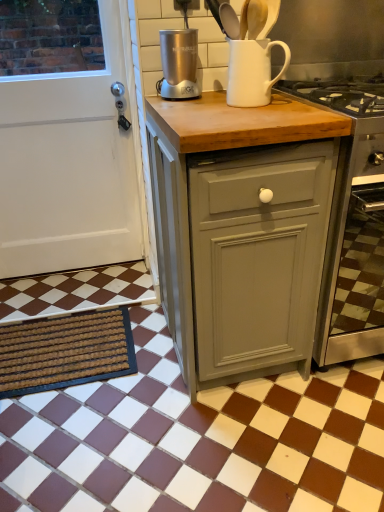
Describe the element at coordinates (179, 64) in the screenshot. I see `satin silver blender at center` at that location.

Measure the distance between point (165, 42) and camera.

Point (165, 42) is 1.32 meters away from camera.

The width and height of the screenshot is (384, 512). Find the location of `white matte door at left`. white matte door at left is located at coordinates (68, 167).

You are a GUI agent. You are given a task and a screenshot of the screen. Output one action in this format:
    pyautogui.click(x=<x>, y=<y>)
    Task: Click on the matte gray cabinet at center
    This screenshot has width=384, height=512.
    Given the screenshot: What is the action you would take?
    pyautogui.click(x=242, y=230)

Between brown/white checkered tile at lower center and brown textured mat at lower left, which one has smaller width?

brown textured mat at lower left.

From a real-world perspective, which is physically below, brown/white checkered tile at lower center or brown textured mat at lower left?

brown/white checkered tile at lower center, from a real-world perspective.

Would you say brown/white checkered tile at lower center is inside or outside brown textured mat at lower left?

brown/white checkered tile at lower center is spatially situated outside brown textured mat at lower left.

Considering the sizes of brown textured mat at lower left and brown/white checkered tile at lower center in the image, is brown textured mat at lower left taller or shorter than brown/white checkered tile at lower center?

→ brown textured mat at lower left is shorter than brown/white checkered tile at lower center.

From a real-world perspective, which is physically below, brown textured mat at lower left or brown/white checkered tile at lower center?

brown/white checkered tile at lower center.

Is the position of brown textured mat at lower left more distant than that of brown/white checkered tile at lower center?

That is True.

Is brown/white checkered tile at lower center at the back of brown textured mat at lower left?

No, brown/white checkered tile at lower center is not at the back of brown textured mat at lower left.

From a real-world perspective, which is physically above, brown textured mat at lower left or white matte door at left?

white matte door at left is physically above.

Which point is more distant from viewer, (x=20, y=324) or (x=75, y=130)?

Positioned behind is point (x=75, y=130).

From the picture: Between brown textured mat at lower left and white matte door at left, which one has larger size?

white matte door at left.

From a real-world perspective, is white matte door at left located higher than white matte jug at upper center?

Actually, white matte door at left is physically below white matte jug at upper center in the real world.

Does white matte door at left lie behind white matte jug at upper center?

Yes, white matte door at left is further from the camera.

How far apart are white matte door at left and white matte jug at upper center?

white matte door at left is 36.24 inches away from white matte jug at upper center.

From the image's perspective, is white matte door at left above or below white matte jug at upper center?

From the image's perspective, white matte door at left appears below white matte jug at upper center.

This screenshot has width=384, height=512. Find the location of `cabinetry positioned vertically above the brown textured mat at lower left (from a real-world perspective)`. cabinetry positioned vertically above the brown textured mat at lower left (from a real-world perspective) is located at coordinates (242, 230).

Considering their positions, is matte gray cabinet at center located in front of or behind brown textured mat at lower left?

Visually, matte gray cabinet at center is located in front of brown textured mat at lower left.

From a real-world perspective, is matte gray cabinet at center physically located above or below brown textured mat at lower left?

matte gray cabinet at center is above brown textured mat at lower left.

From the image's perspective, does matte gray cabinet at center appear higher than white matte door at left?

No, from the image's perspective, matte gray cabinet at center is not above white matte door at left.

Does point (286, 264) lie behind point (4, 247)?

That is False.

Does matte gray cabinet at center have a greater height compared to white matte door at left?

No, matte gray cabinet at center is not taller than white matte door at left.

Is matte gray cabinet at center not close to white matte door at left?

That's not correct — matte gray cabinet at center is a little close to white matte door at left.

Can you confirm if matte gray cabinet at center is bigger than brown/white checkered tile at lower center?

Correct, matte gray cabinet at center is larger in size than brown/white checkered tile at lower center.

Is matte gray cabinet at center not inside brown/white checkered tile at lower center?

matte gray cabinet at center is positioned outside brown/white checkered tile at lower center.

What's the angular difference between matte gray cabinet at center and brown/white checkered tile at lower center's facing directions?

89.5 degrees separate the facing orientations of matte gray cabinet at center and brown/white checkered tile at lower center.

From the image's perspective, is matte gray cabinet at center located beneath brown/white checkered tile at lower center?

Incorrect, from the image's perspective, matte gray cabinet at center is higher than brown/white checkered tile at lower center.

What are the coordinates of `tile in front of the brown textured mat at lower left` in the screenshot? It's located at (197, 440).

In order to click on tile below the brown textured mat at lower left (from the image's perspective) in this screenshot , I will do `click(197, 440)`.

Considering their positions, is satin silver blender at center positioned closer to matte gray cabinet at center than white matte jug at upper center?

white matte jug at upper center lies closer to matte gray cabinet at center than the other object.

When comparing their distances from white matte jug at upper center, does matte gray cabinet at center or brown textured mat at lower left seem closer?

Based on the image, matte gray cabinet at center appears to be nearer to white matte jug at upper center.

Which object lies further to the anchor point satin silver blender at center, white matte door at left or matte gray cabinet at center?

white matte door at left is positioned further to the anchor satin silver blender at center.

From the image, which object appears to be nearer to satin silver blender at center, white matte door at left or white matte jug at upper center?

white matte jug at upper center.

When comparing their distances from brown/white checkered tile at lower center, does white matte door at left or matte gray cabinet at center seem further?

white matte door at left.

Considering their positions, is satin silver blender at center positioned further to brown textured mat at lower left than white matte door at left?

Among the two, satin silver blender at center is located further to brown textured mat at lower left.

Based on the photo, from the image, which object appears to be nearer to brown/white checkered tile at lower center, matte gray cabinet at center or white matte jug at upper center?

The object closer to brown/white checkered tile at lower center is matte gray cabinet at center.

Considering their positions, is white matte door at left positioned closer to white matte jug at upper center than satin silver blender at center?

satin silver blender at center is closer to white matte jug at upper center.

Find the location of `jug between satin silver blender at center and matte gray cabinet at center in the vertical direction`. jug between satin silver blender at center and matte gray cabinet at center in the vertical direction is located at coordinates (252, 71).

Image resolution: width=384 pixels, height=512 pixels. I want to click on cabinetry between white matte door at left and brown textured mat at lower left from top to bottom, so click(x=242, y=230).

Where is `doormat that lies between white matte jug at upper center and brown/white checkered tile at lower center from top to bottom`? The width and height of the screenshot is (384, 512). doormat that lies between white matte jug at upper center and brown/white checkered tile at lower center from top to bottom is located at coordinates (65, 351).

At what (x,y) coordinates should I click in order to perform the action: click on cabinetry between white matte jug at upper center and brown/white checkered tile at lower center in the vertical direction. Please return your answer as a coordinate pair (x, y). The height and width of the screenshot is (512, 384). Looking at the image, I should click on (242, 230).